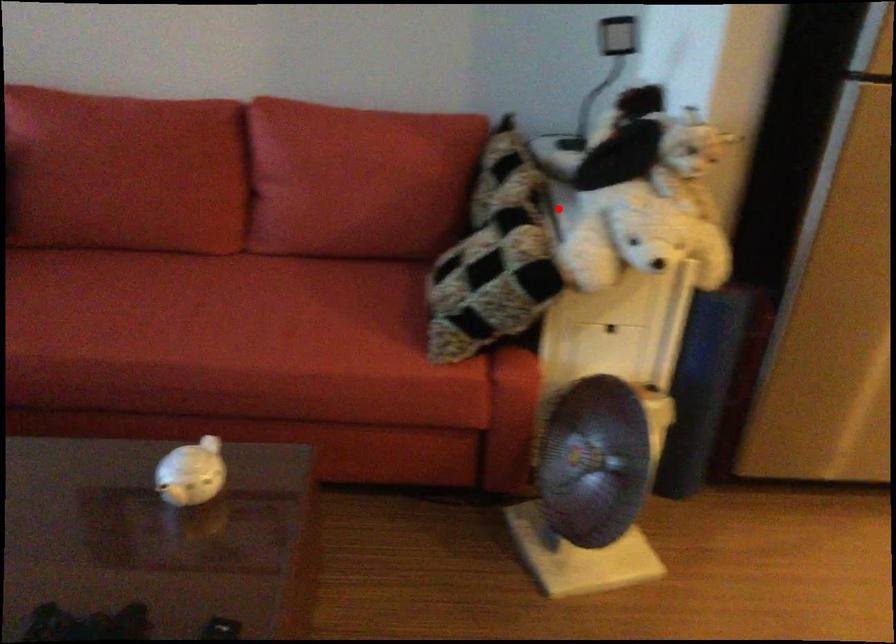
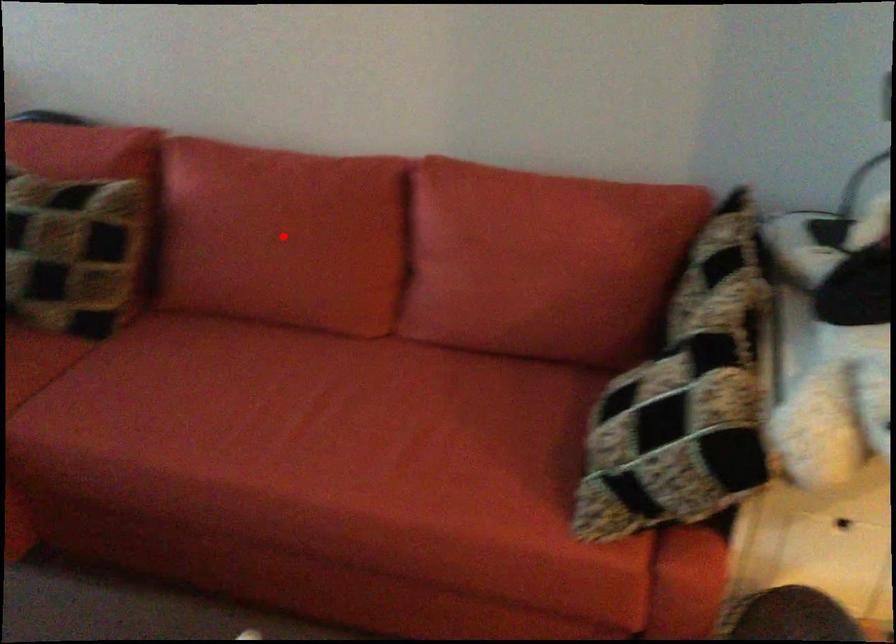
I am providing you with two images of the same scene from different viewpoints. A red point is marked on the first image and another point is marked on the second image. Do the highlighted points in image1 and image2 indicate the same real-world spot?

No